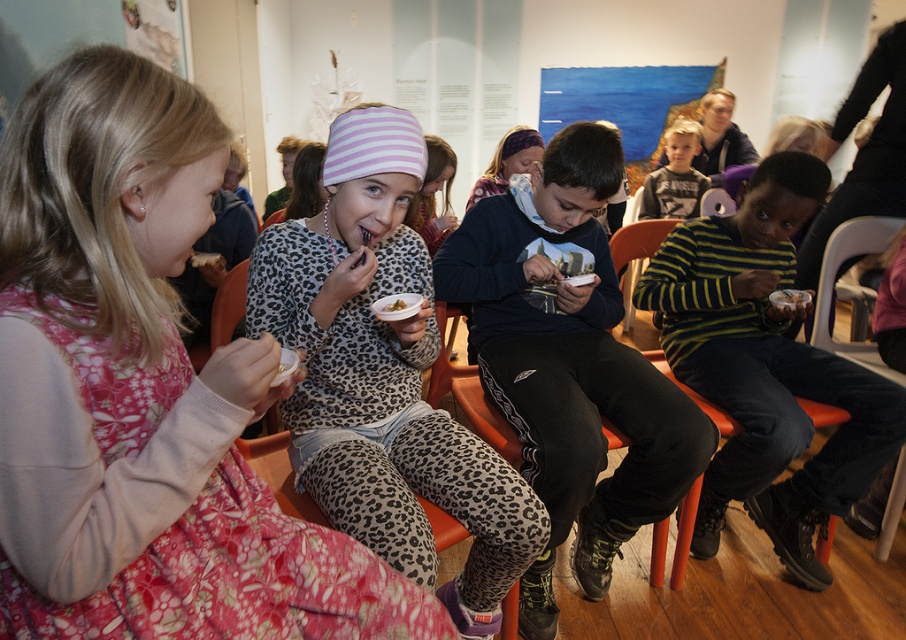
You are standing at the entrance of the room and want to sit down on the white plastic chair at lower right. Based on its position, can you estimate whether it is near the edge of the room or closer to the center?

The white plastic chair at lower right is located at point (x=834, y=284), which suggests it is near the edge of the room since the coordinates are closer to the maximum value in the x and y axes, indicating proximity to the lower right corner.

You are a photographer taking a picture of the children in the scene. You notice the pink striped fabric headband at upper center and the leopard print sweater at center. Which object is closer to the camera?

The pink striped fabric headband at upper center is closer to the camera because it is shorter than the leopard print sweater at center, meaning it would appear nearer in the photo.

In the scene shown: You are standing in the room where the children are sitting. You need to locate the pink striped fabric headband at upper center. According to the coordinates provided, where exactly is it positioned?

The pink striped fabric headband at upper center is located at coordinates point (x=143, y=394).